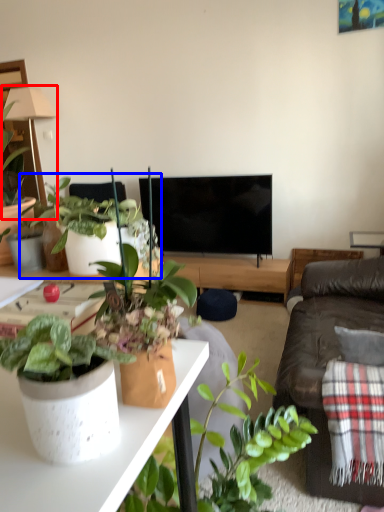
Question: Which object is closer to the camera taking this photo, lamp (highlighted by a red box) or houseplant (highlighted by a blue box)?

Choices:
 (A) lamp
 (B) houseplant

Answer: (B)